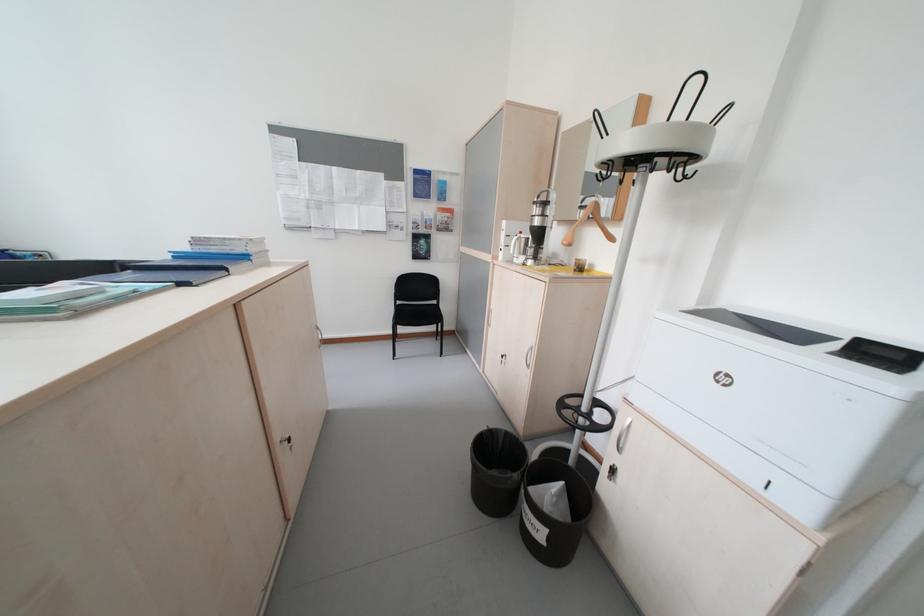
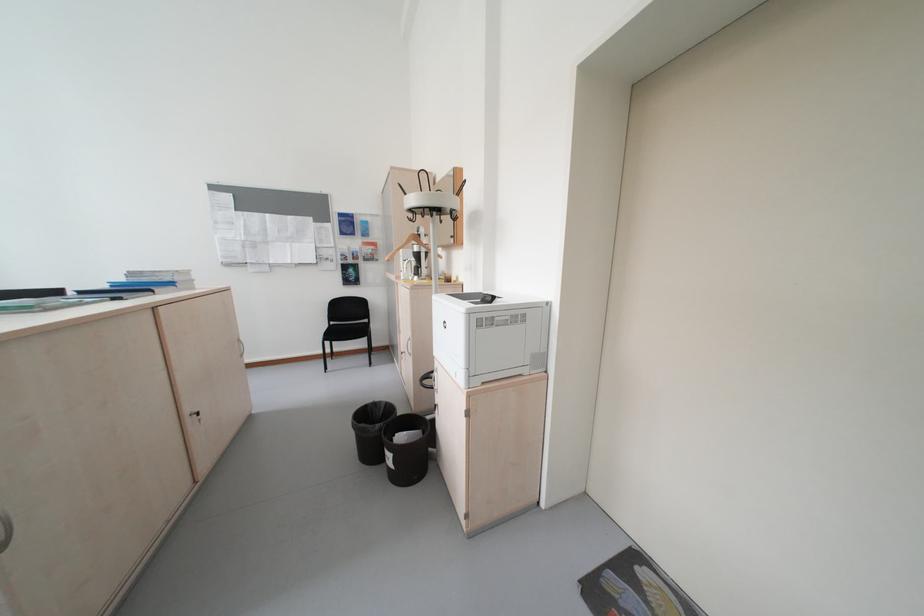
Find the pixel in the second image that matches pixel 290 451 in the first image.

(200, 421)